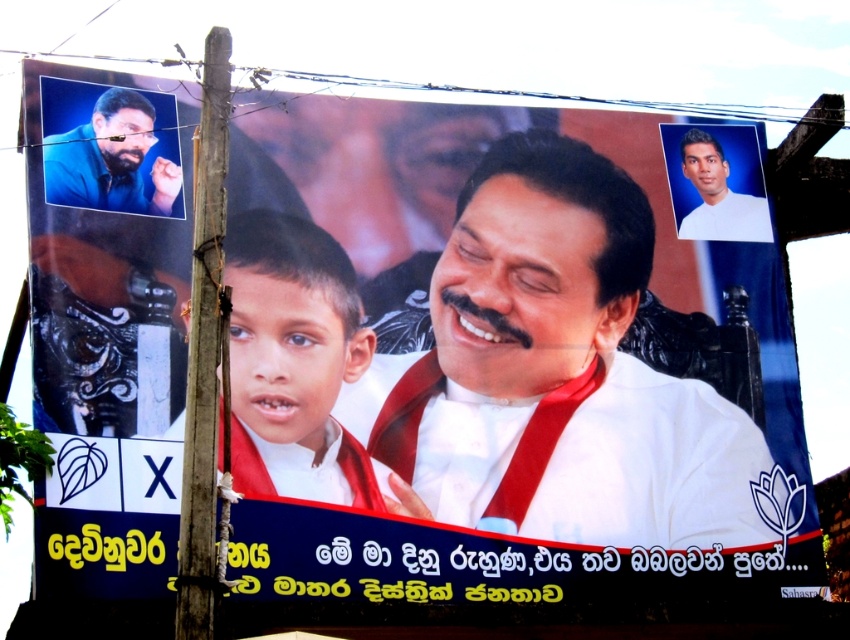
You are a graphic designer working on a poster layout. You need to ensure that the white glossy boy at center and the matte blue shirt at upper left are visible to viewers from a distance. Considering their sizes, which object should you adjust to improve visibility?

The white glossy boy at center has a larger size compared to matte blue shirt at upper left. To improve visibility of the smaller matte blue shirt at upper left, you should consider increasing its size so it can be seen more clearly from a distance.